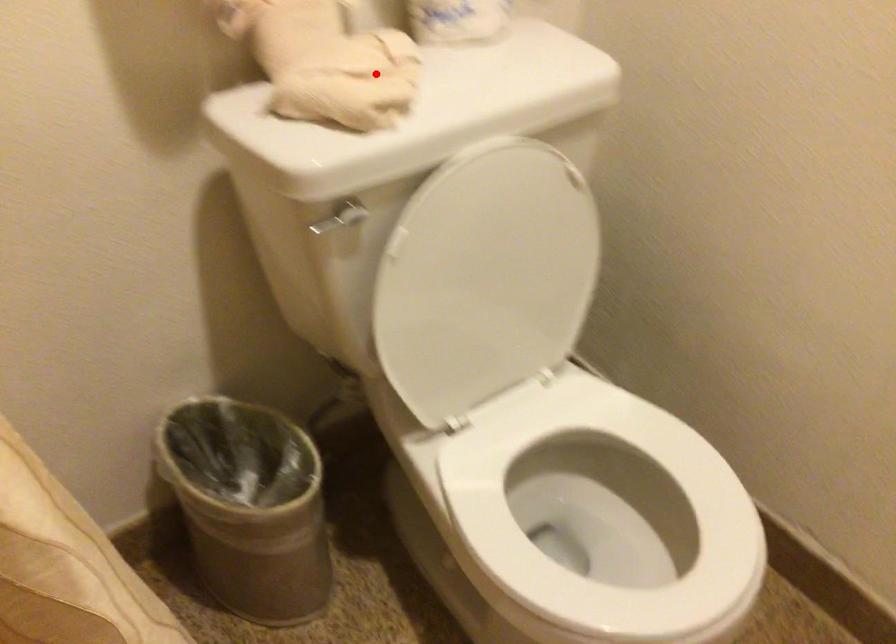
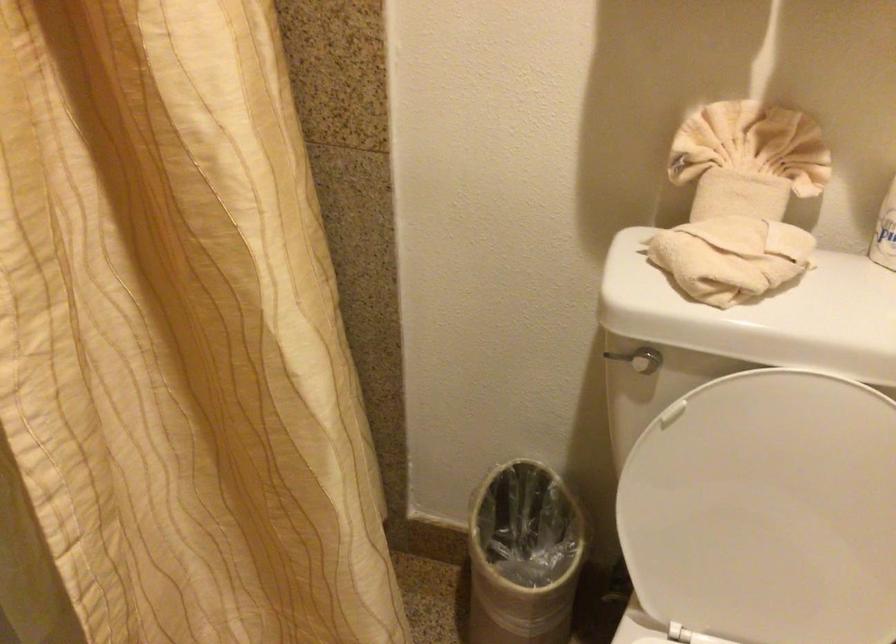
Locate, in the second image, the point that corresponds to the highlighted location in the first image.

(730, 257)